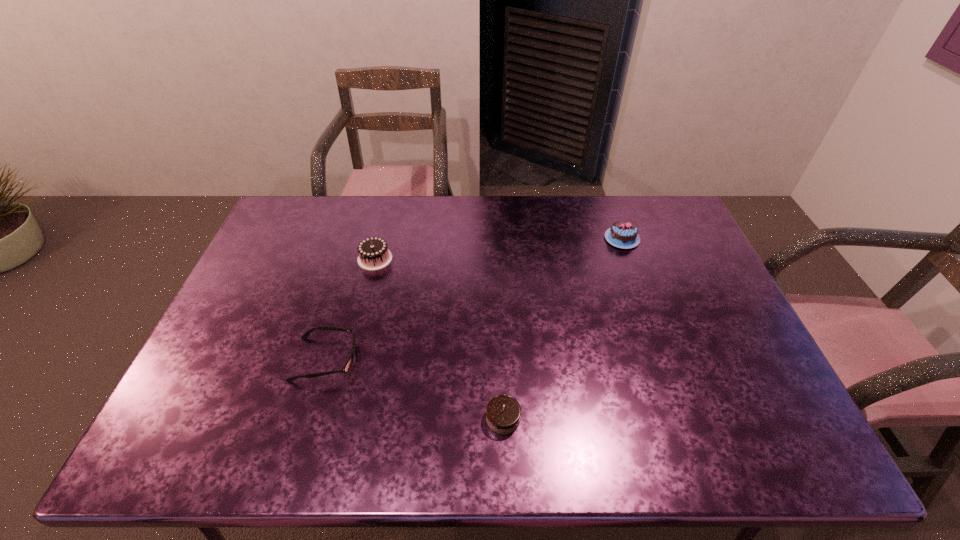
The width and height of the screenshot is (960, 540). Find the location of `free space located on the front-facing side of the spectacles`. free space located on the front-facing side of the spectacles is located at coordinates (375, 359).

You are a GUI agent. You are given a task and a screenshot of the screen. Output one action in this format:
    pyautogui.click(x=<x>, y=<y>)
    Task: Click on the object located in the far edge section of the desktop
    The width and height of the screenshot is (960, 540).
    Given the screenshot: What is the action you would take?
    pyautogui.click(x=622, y=234)

Locate an element on the screen. object present at the near edge is located at coordinates (503, 412).

At what (x,y) coordinates should I click in order to perform the action: click on vacant space at the far edge of the desktop. Please return your answer as a coordinate pair (x, y). The image size is (960, 540). Looking at the image, I should click on (418, 207).

The width and height of the screenshot is (960, 540). Find the location of `free location at the near edge`. free location at the near edge is located at coordinates (608, 458).

Locate an element on the screen. This screenshot has height=540, width=960. free space at the left edge is located at coordinates (232, 342).

The height and width of the screenshot is (540, 960). In order to click on free space at the right edge of the desktop in this screenshot , I will do `click(695, 256)`.

Where is `vacant space at the far left corner`? vacant space at the far left corner is located at coordinates (289, 236).

Identify the location of free space at the far right corner. (645, 214).

Image resolution: width=960 pixels, height=540 pixels. In order to click on free space between the tallest chocolate cake and the nearest object in this screenshot , I will do `click(439, 339)`.